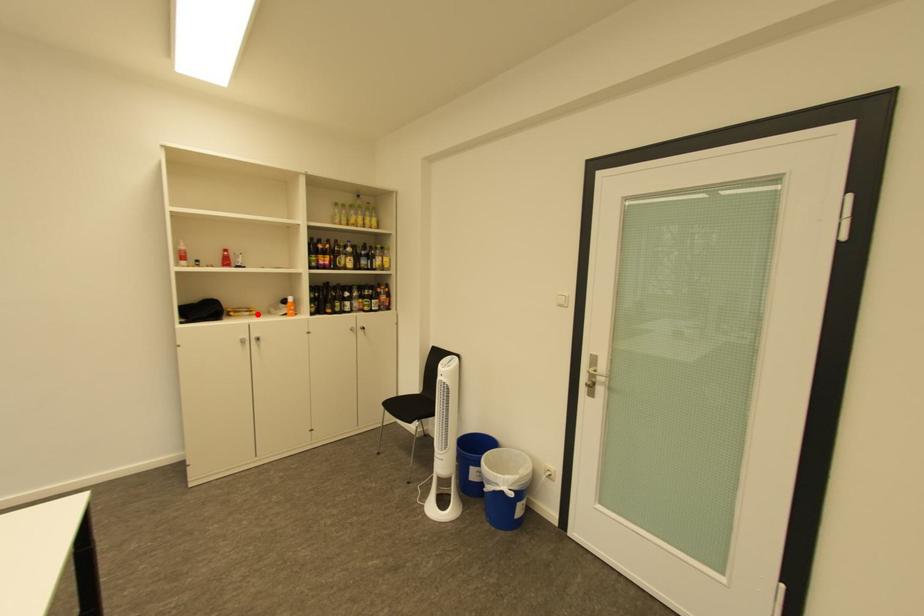
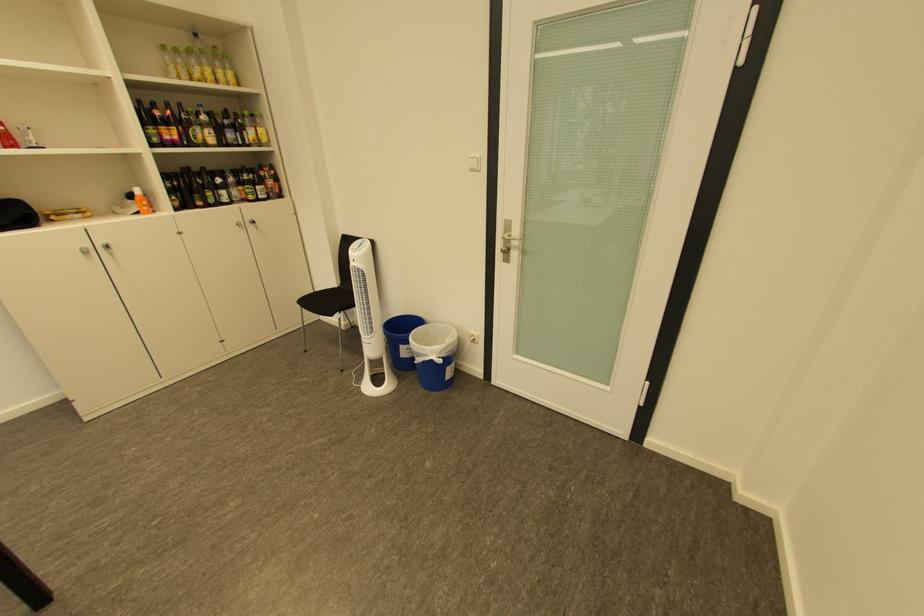
Question: I am providing you with two images of the same scene from different viewpoints. Given a red point in image1, look at the same physical point in image2. Is it:

Choices:
 (A) Closer to the viewpoint
 (B) Farther from the viewpoint

Answer: (B)